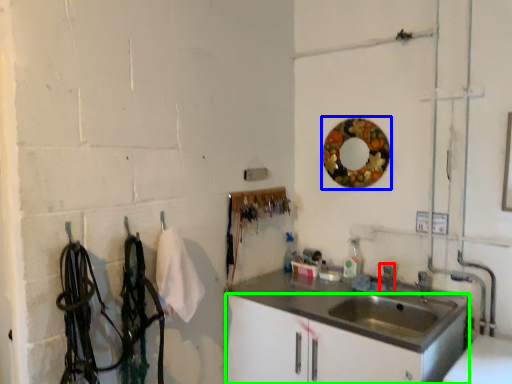
Question: Which is nearer to the faucet (highlighted by a red box)? mirror (highlighted by a blue box) or bathroom cabinet (highlighted by a green box).

Choices:
 (A) mirror
 (B) bathroom cabinet

Answer: (B)